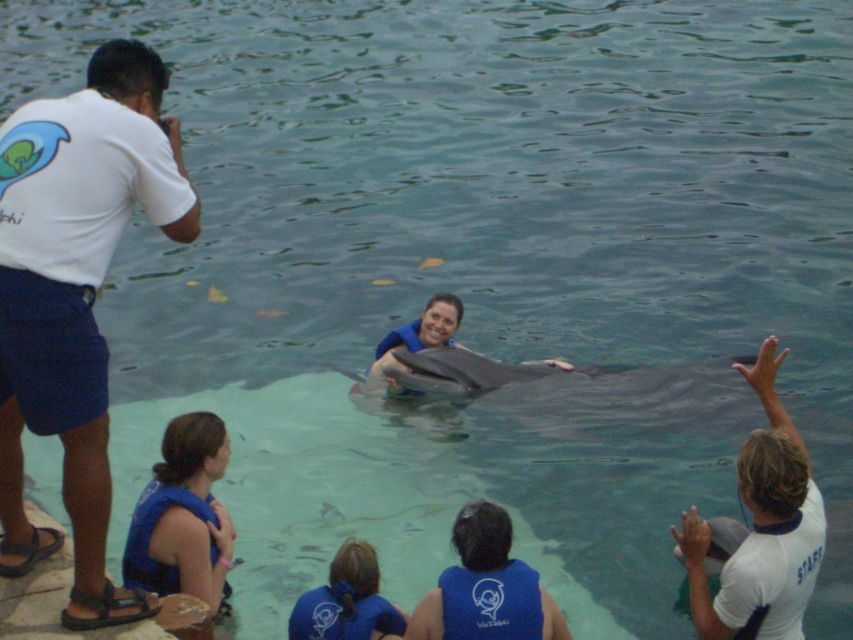
You are a photographer standing at the edge of the pool. You want to take a photo of the two points in the scene. Which point, point 1 at coordinate (215, 547) or point 2 at coordinate (459, 394), will appear larger in your camera view?

Point 1 at coordinate (215, 547) will appear larger in the camera view because it is closer to the viewer than point 2 at coordinate (459, 394).